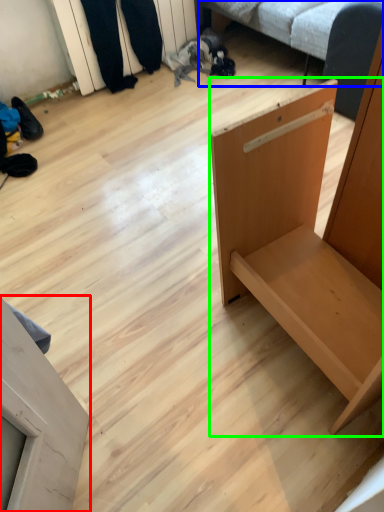
Question: Which object is positioned farthest from furniture (highlighted by a red box)? Select from studio couch (highlighted by a blue box) and furniture (highlighted by a green box).

Choices:
 (A) studio couch
 (B) furniture

Answer: (A)